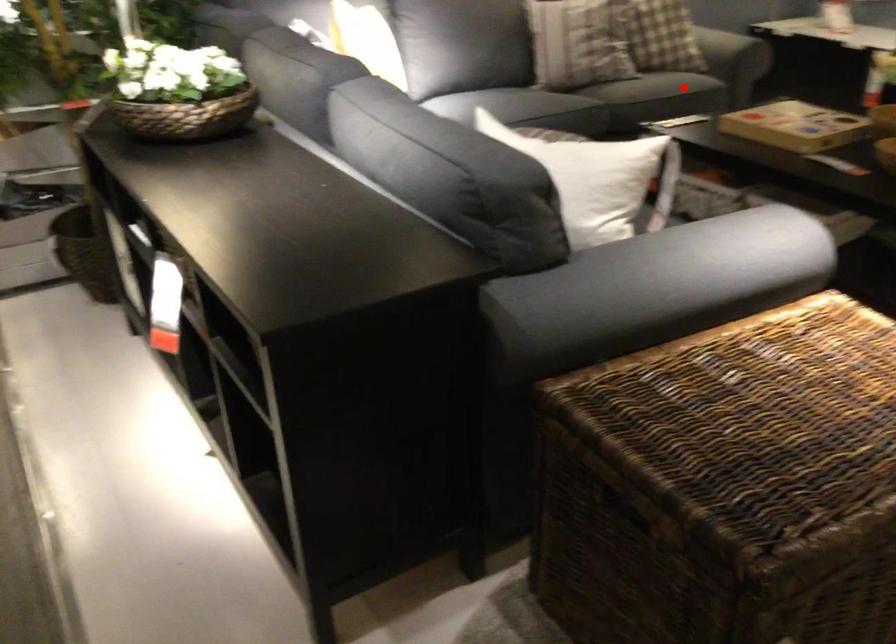
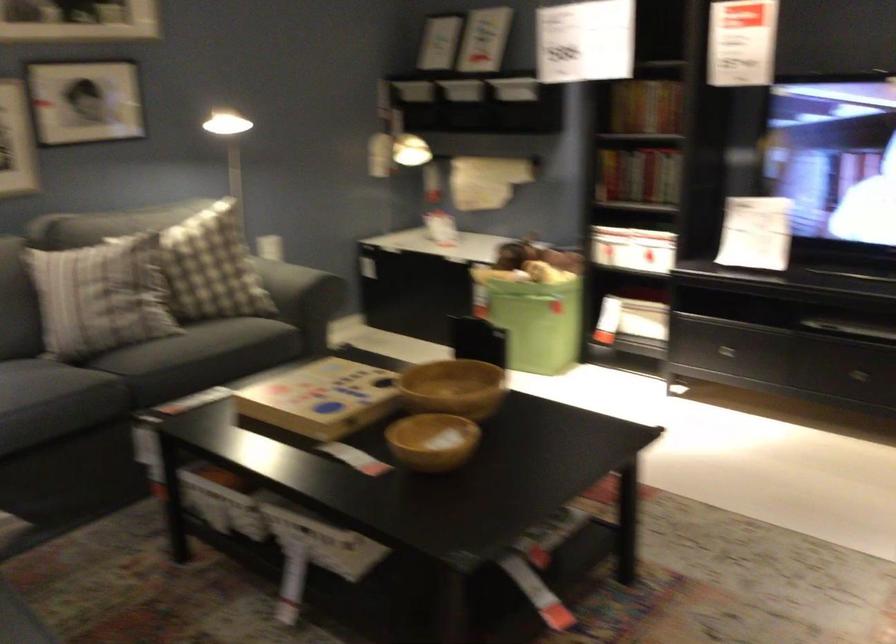
Question: I am providing you with two images of the same scene from different viewpoints. In image1, a red point is highlighted. Considering the same 3D point in image2, which of the following is correct?

Choices:
 (A) It is closer
 (B) It is farther

Answer: (A)